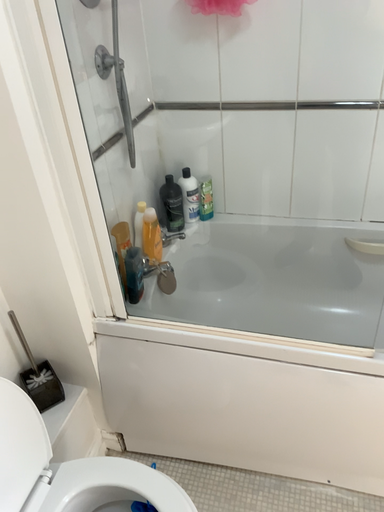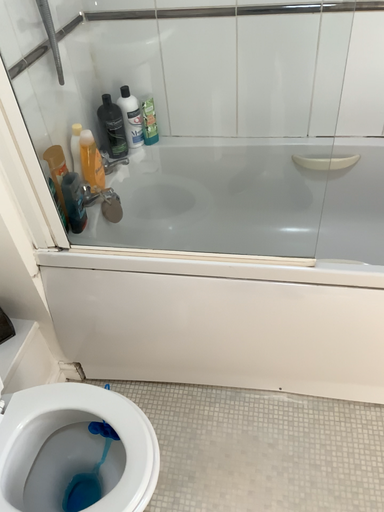
Question: How did the camera likely rotate when shooting the video?

Choices:
 (A) rotated downward
 (B) rotated upward

Answer: (A)